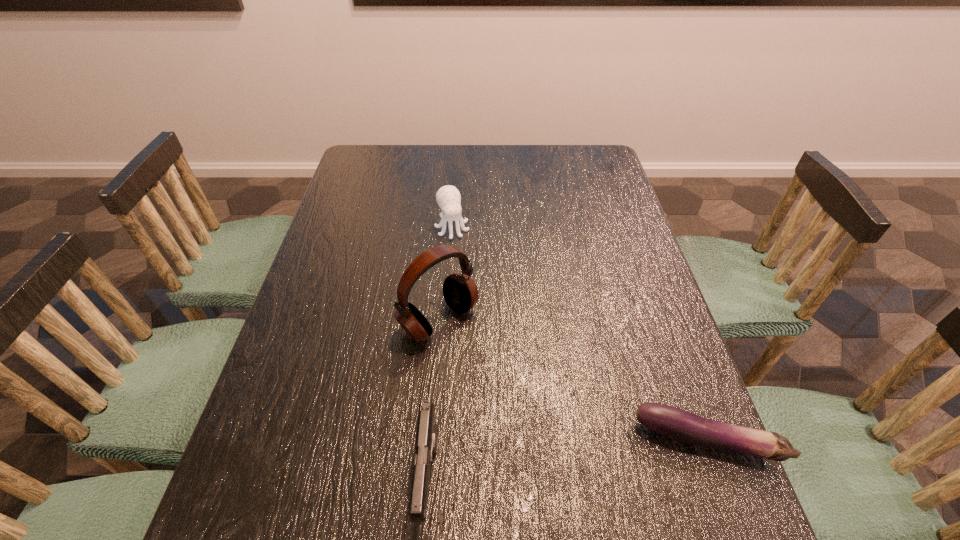
This screenshot has height=540, width=960. In order to click on free space that is in between the pistol and the rightmost object in this screenshot , I will do `click(567, 460)`.

Locate an element on the screen. This screenshot has width=960, height=540. vacant space that's between the farthest object and the pistol is located at coordinates (441, 354).

Where is `vacant area that lies between the octopus and the pistol`? This screenshot has height=540, width=960. vacant area that lies between the octopus and the pistol is located at coordinates (441, 354).

Select which object is the third closest to the farthest object. Please provide its 2D coordinates. Your answer should be formatted as a tuple, i.e. [(x, y)], where the tuple contains the x and y coordinates of a point satisfying the conditions above.

[(680, 425)]

Identify which object is the second nearest to the third nearest object. Please provide its 2D coordinates. Your answer should be formatted as a tuple, i.e. [(x, y)], where the tuple contains the x and y coordinates of a point satisfying the conditions above.

[(448, 197)]

The height and width of the screenshot is (540, 960). What are the coordinates of `blank area in the image that satisfies the following two spatial constraints: 1. on the front side of the farthest object; 2. on the right side of the eggplant` in the screenshot? It's located at (438, 440).